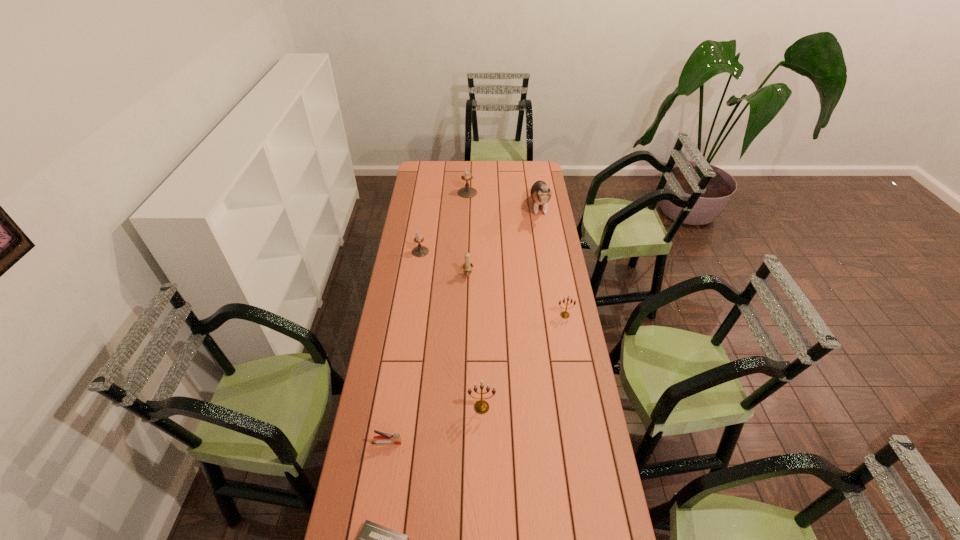
Identify the location of the tallest object. (540, 192).

The height and width of the screenshot is (540, 960). Find the location of `the right purple candle holder`. the right purple candle holder is located at coordinates (466, 192).

Locate an element on the screen. This screenshot has width=960, height=540. the bigger purple candle holder is located at coordinates (466, 192).

Where is `the bigger gold candelabrum`? the bigger gold candelabrum is located at coordinates (481, 406).

You are a GUI agent. You are given a task and a screenshot of the screen. Output one action in this format:
    pyautogui.click(x=<x>, y=<y>)
    Task: Click on the left gold candelabrum
    Image resolution: width=960 pixels, height=540 pixels.
    Given the screenshot: What is the action you would take?
    pyautogui.click(x=481, y=406)

This screenshot has width=960, height=540. I want to click on the fourth farthest object, so click(467, 267).

Where is `the third farthest object`? The width and height of the screenshot is (960, 540). the third farthest object is located at coordinates (419, 251).

Identify the location of the second farthest candelabrum. Image resolution: width=960 pixels, height=540 pixels. (419, 251).

Locate an element on the screen. The height and width of the screenshot is (540, 960). the fourth nearest object is located at coordinates (564, 314).

The image size is (960, 540). I want to click on the farther gold candelabrum, so click(x=564, y=314).